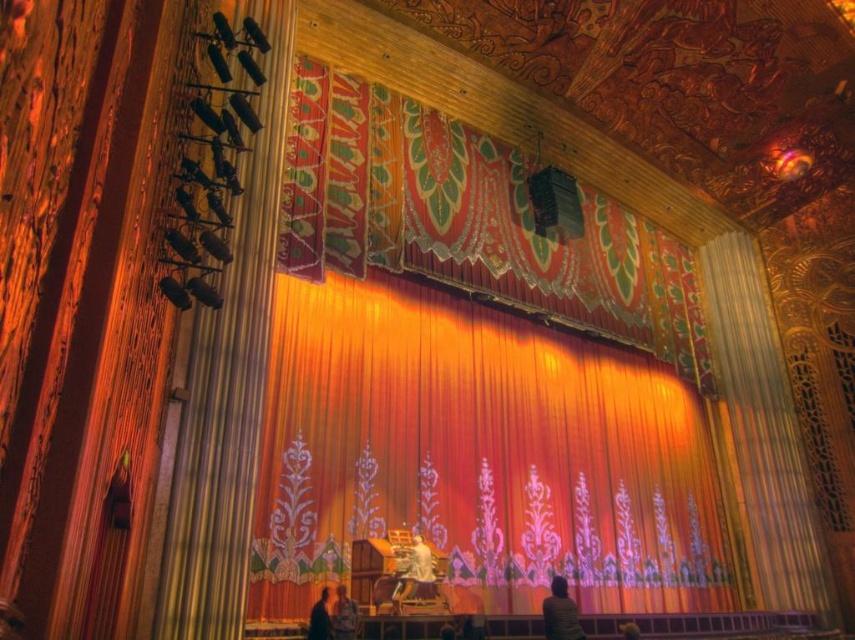
You are standing in the theater and want to know how far the point at coordinates [759,534] is from you. Can you determine the distance?

The point at coordinates [759,534] is 38.79 meters away from the viewer.

You are standing in the theater and see the point marked at coordinate [478,454]. Based on the scene description, where is this point located?

The point at coordinate [478,454] is located on the orange velvet curtain at center.